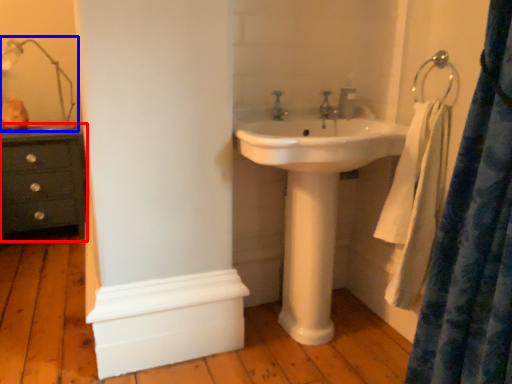
Question: Which of the following is the closest to the observer, chest of drawers (highlighted by a red box) or table lamp (highlighted by a blue box)?

Choices:
 (A) chest of drawers
 (B) table lamp

Answer: (B)